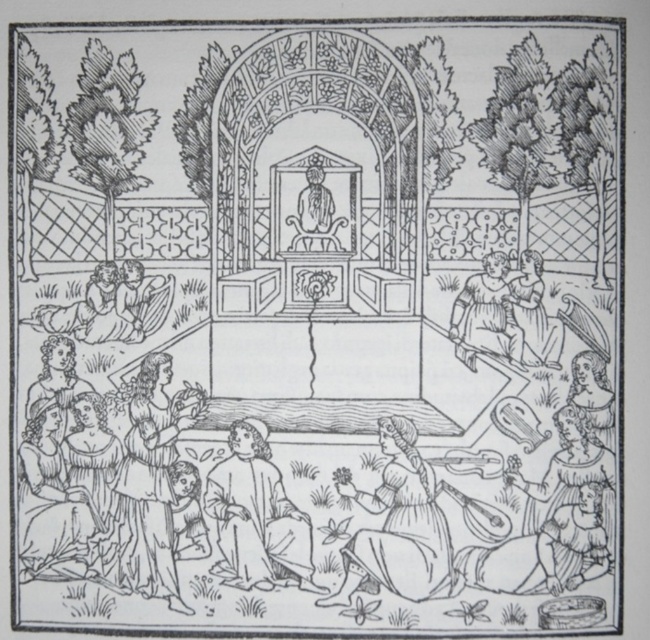
Question: Among these points, which one is nearest to the camera?

Choices:
 (A) (462, 320)
 (B) (413, 428)
 (C) (208, 492)

Answer: (C)

Question: Which point is closer to the camera taking this photo?

Choices:
 (A) (456, 305)
 (B) (211, 506)
 (C) (110, 320)

Answer: (B)

Question: Which object is closer to the camera taking this photo?

Choices:
 (A) smooth brown hair at lower left
 (B) smooth brown dress at lower center
 (C) smooth skin figure at lower left
 (D) smooth beige robe at lower center

Answer: (B)

Question: Is smooth brown dress at lower center thinner than smooth skin figure at lower left?

Choices:
 (A) yes
 (B) no

Answer: (B)

Question: Is smooth brown dress at lower left below smooth skin figure at lower left?

Choices:
 (A) no
 (B) yes

Answer: (B)

Question: Is smooth brown dress at lower center to the left of smooth skin figure at lower left from the viewer's perspective?

Choices:
 (A) no
 (B) yes

Answer: (A)